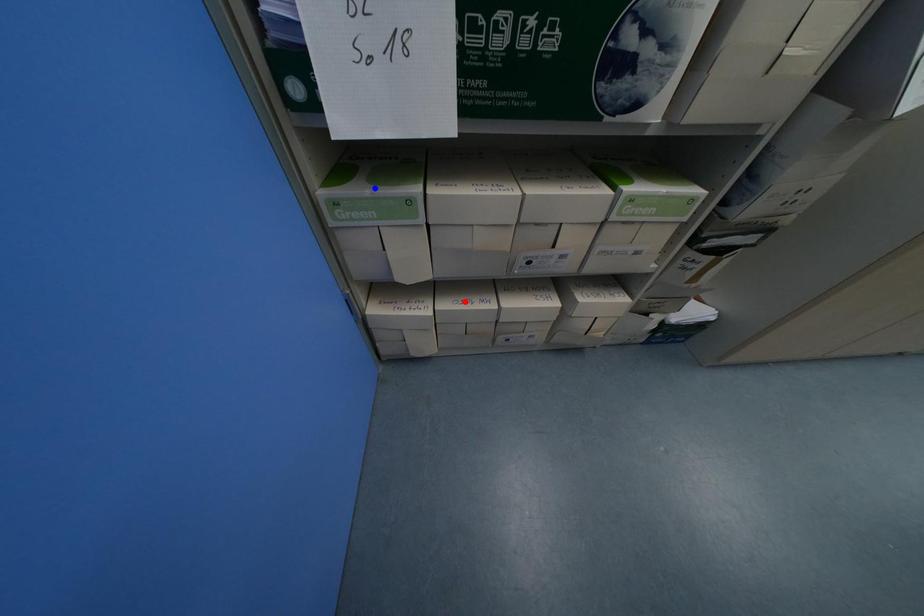
Question: Two points are marked on the image. Which point is closer to the camera?

Choices:
 (A) Blue point is closer.
 (B) Red point is closer.

Answer: (A)